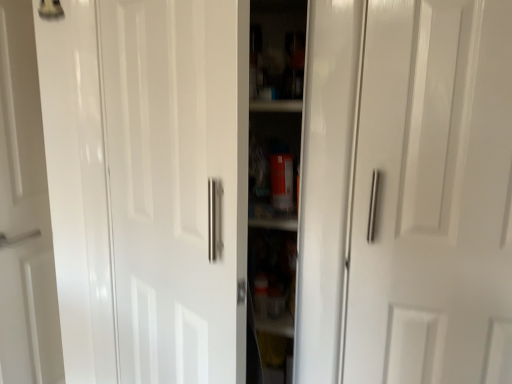
Question: Is there a large distance between white glossy door handle at right, the 1th door viewed from the right, and white glossy door at center, acting as the first door starting from the left?

Choices:
 (A) yes
 (B) no

Answer: (B)

Question: From the image's perspective, is white glossy door handle at right, the 1th door viewed from the right, located above white glossy door at center, acting as the first door starting from the left?

Choices:
 (A) yes
 (B) no

Answer: (A)

Question: Can you confirm if white glossy door handle at right, the 1th door viewed from the right, is thinner than white glossy door at center, acting as the first door starting from the left?

Choices:
 (A) no
 (B) yes

Answer: (A)

Question: Is white glossy door handle at right, the 1th door viewed from the right, shorter than white glossy door at center, the 2th door viewed from the right?

Choices:
 (A) no
 (B) yes

Answer: (B)

Question: Are white glossy door handle at right, which is the second door from left to right, and white glossy door at center, the 2th door viewed from the right, making contact?

Choices:
 (A) no
 (B) yes

Answer: (A)

Question: Could you tell me if white glossy door handle at right, which is the second door from left to right, is facing white glossy door at center, the 2th door viewed from the right?

Choices:
 (A) no
 (B) yes

Answer: (A)

Question: Is white glossy door at center, the 2th door viewed from the right, at the left side of white glossy door handle at right, which is the second door from left to right?

Choices:
 (A) no
 (B) yes

Answer: (B)

Question: From a real-world perspective, is white glossy door at center, acting as the first door starting from the left, located higher than white glossy door handle at right, which is the second door from left to right?

Choices:
 (A) no
 (B) yes

Answer: (A)

Question: Is white glossy door at center, acting as the first door starting from the left, shorter than white glossy door handle at right, the 1th door viewed from the right?

Choices:
 (A) no
 (B) yes

Answer: (A)

Question: Would you say white glossy door at center, acting as the first door starting from the left, contains white glossy door handle at right, the 1th door viewed from the right?

Choices:
 (A) yes
 (B) no

Answer: (B)

Question: Is white glossy door at center, acting as the first door starting from the left, taller than white glossy door handle at right, which is the second door from left to right?

Choices:
 (A) yes
 (B) no

Answer: (A)

Question: Considering the relative positions of white glossy door at center, acting as the first door starting from the left, and white glossy door handle at right, the 1th door viewed from the right, in the image provided, is white glossy door at center, acting as the first door starting from the left, to the right of white glossy door handle at right, the 1th door viewed from the right, from the viewer's perspective?

Choices:
 (A) yes
 (B) no

Answer: (B)

Question: From a real-world perspective, is white glossy door at center, acting as the first door starting from the left, physically located above or below white glossy door handle at right, the 1th door viewed from the right?

Choices:
 (A) below
 (B) above

Answer: (A)